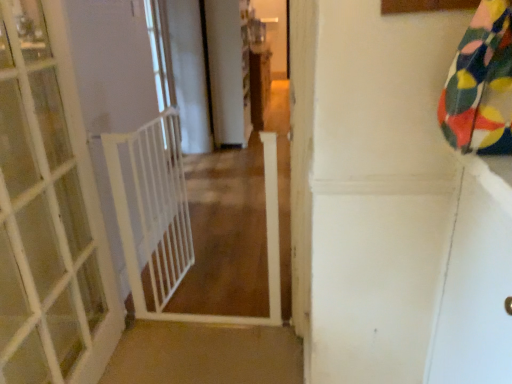
Question: From the image's perspective, is white plastic gate at center under white plastic balustrade at left?

Choices:
 (A) yes
 (B) no

Answer: (A)

Question: Could you tell me if white plastic gate at center is facing white plastic balustrade at left?

Choices:
 (A) no
 (B) yes

Answer: (A)

Question: Is the position of white plastic gate at center more distant than that of white plastic balustrade at left?

Choices:
 (A) yes
 (B) no

Answer: (B)

Question: Considering the relative sizes of white plastic gate at center and white plastic balustrade at left in the image provided, is white plastic gate at center smaller than white plastic balustrade at left?

Choices:
 (A) no
 (B) yes

Answer: (A)

Question: Is white plastic gate at center far away from white plastic balustrade at left?

Choices:
 (A) no
 (B) yes

Answer: (A)

Question: Is point (227, 168) closer or farther from the camera than point (4, 354)?

Choices:
 (A) closer
 (B) farther

Answer: (B)

Question: Would you say white plastic gate at center is inside or outside white wooden door at left?

Choices:
 (A) outside
 (B) inside

Answer: (A)

Question: From a real-world perspective, relative to white wooden door at left, is white plastic gate at center vertically above or below?

Choices:
 (A) below
 (B) above

Answer: (A)

Question: Is white plastic gate at center taller or shorter than white wooden door at left?

Choices:
 (A) short
 (B) tall

Answer: (A)

Question: From the image's perspective, is white plastic balustrade at left located above or below white plastic gate at left?

Choices:
 (A) above
 (B) below

Answer: (B)

Question: In terms of size, does white plastic balustrade at left appear bigger or smaller than white plastic gate at left?

Choices:
 (A) big
 (B) small

Answer: (B)

Question: Is point (113, 193) positioned closer to the camera than point (157, 92)?

Choices:
 (A) closer
 (B) farther

Answer: (A)

Question: From their relative heights in the image, would you say white plastic balustrade at left is taller or shorter than white plastic gate at left?

Choices:
 (A) tall
 (B) short

Answer: (B)

Question: Looking at their shapes, would you say white plastic gate at left is wider or thinner than white glossy screen door at upper right?

Choices:
 (A) thin
 (B) wide

Answer: (A)

Question: From the image's perspective, is white plastic gate at left above or below white glossy screen door at upper right?

Choices:
 (A) below
 (B) above

Answer: (B)